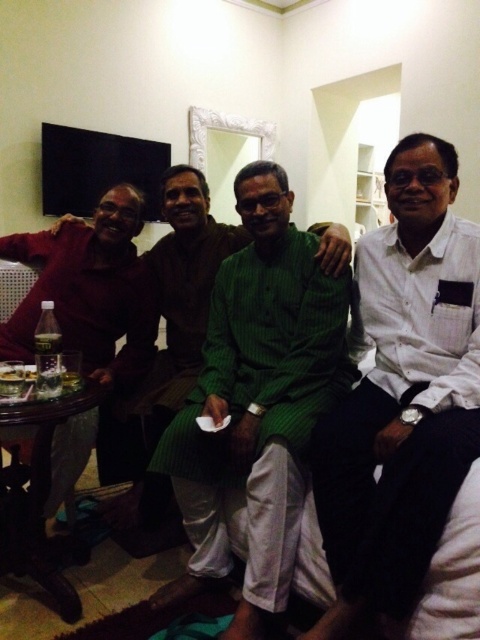
You are a photographer trying to capture a group photo of the men in the living room. The camera you are using has a focus range of 10 inches. Can you focus on both the white cotton shirt at right and the green textured kurta at center at the same time?

The white cotton shirt at right and the green textured kurta at center are 9.89 inches apart, so yes, the camera can focus on both since the distance between them is within the 10 inch focus range.

You are a tailor who needs to determine which garment requires more fabric for alterations. Based on the image, which garment has a larger width between the white cotton shirt at right and the green textured kurta at center?

The green textured kurta at center has a larger width than the white cotton shirt at right, so it requires more fabric for alterations.